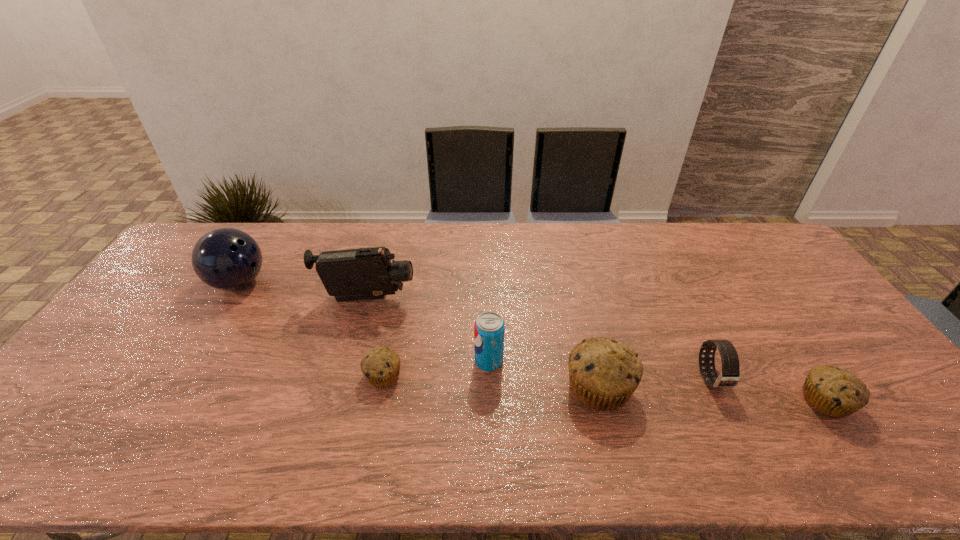
Locate an element on the screen. The width and height of the screenshot is (960, 540). vacant space located on the back of the leftmost muffin is located at coordinates (394, 325).

Where is `vacant position located on the right of the third object from right to left`? vacant position located on the right of the third object from right to left is located at coordinates (787, 388).

Where is `vacant space located on the left of the rightmost muffin`? vacant space located on the left of the rightmost muffin is located at coordinates (655, 401).

In order to click on vacant space located on the surface of the bowling ball near the finger holes in this screenshot , I will do `click(327, 282)`.

Where is `free space located on the front of the fourth object from left to right`? The width and height of the screenshot is (960, 540). free space located on the front of the fourth object from left to right is located at coordinates (490, 389).

In order to click on blank space located 0.090m on the front-facing side of the camcorder in this screenshot , I will do point(444,299).

At what (x,y) coordinates should I click in order to perform the action: click on blank space located on the face of the watch. Please return your answer as a coordinate pair (x, y). This screenshot has height=540, width=960. Looking at the image, I should click on tap(732, 424).

Identify the location of object that is at the far edge. This screenshot has height=540, width=960. (226, 258).

Locate an element on the screen. The image size is (960, 540). watch that is at the near edge is located at coordinates (729, 377).

Find the location of a particular element. The height and width of the screenshot is (540, 960). object situated at the right edge is located at coordinates (835, 392).